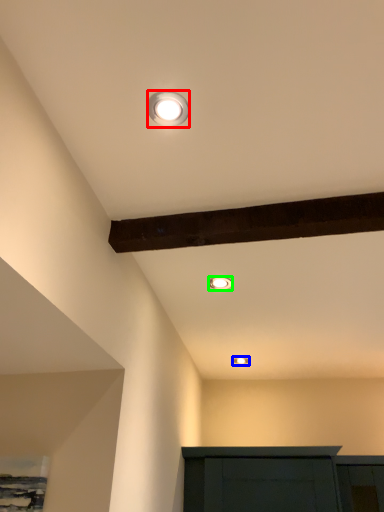
Question: Based on their relative distances, which object is nearer to lamp (highlighted by a red box)? Choose from lamp (highlighted by a blue box) and lamp (highlighted by a green box).

Choices:
 (A) lamp
 (B) lamp

Answer: (B)